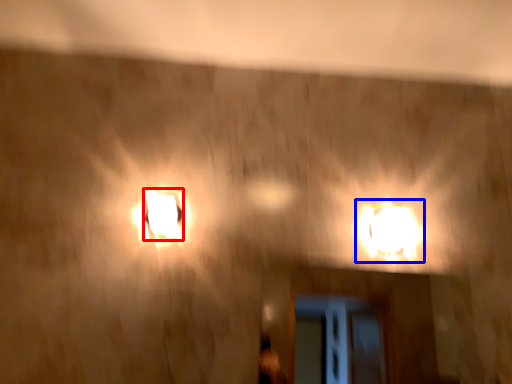
Question: Which object is further to the camera taking this photo, lamp (highlighted by a red box) or lamp (highlighted by a blue box)?

Choices:
 (A) lamp
 (B) lamp

Answer: (B)